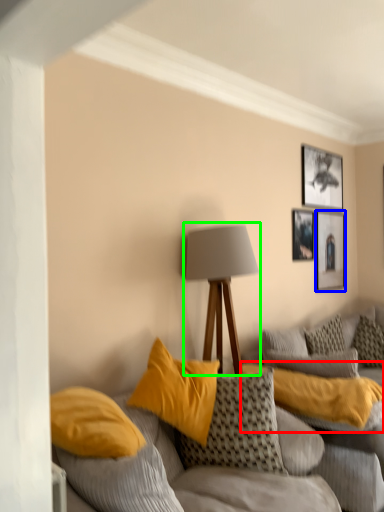
Question: Which is nearer to the pillow (highlighted by a red box)? picture frame (highlighted by a blue box) or lamp (highlighted by a green box).

Choices:
 (A) picture frame
 (B) lamp

Answer: (B)